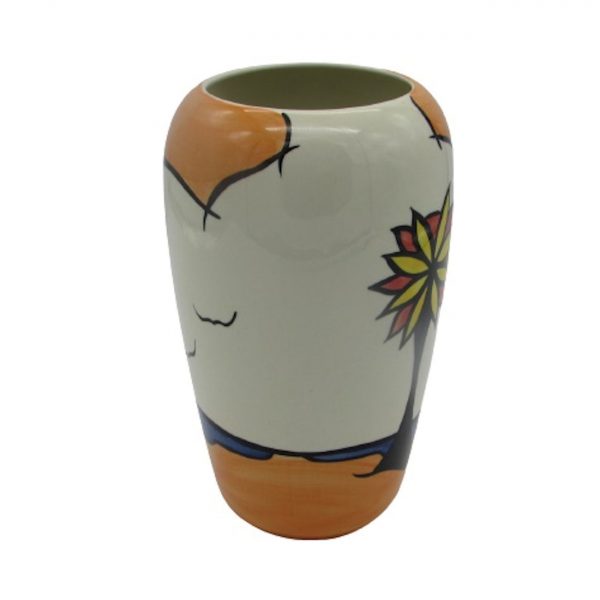
Find the location of a particular element. This screenshot has height=600, width=600. hand painted decorative vase is located at coordinates (303, 188).